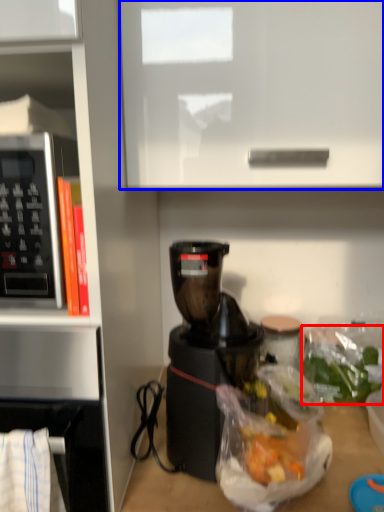
Question: Among these objects, which one is nearest to the camera, food (highlighted by a red box) or cabinetry (highlighted by a blue box)?

Choices:
 (A) food
 (B) cabinetry

Answer: (B)